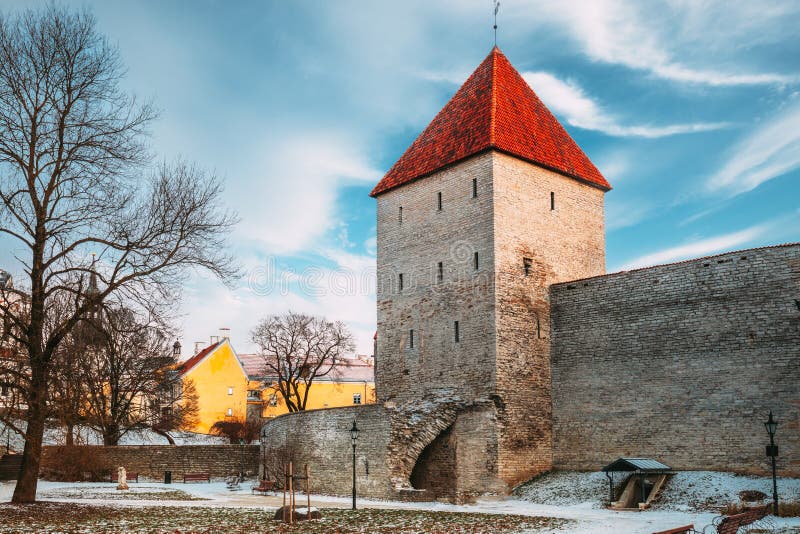
Where is `stairway`? The height and width of the screenshot is (534, 800). stairway is located at coordinates (13, 463).